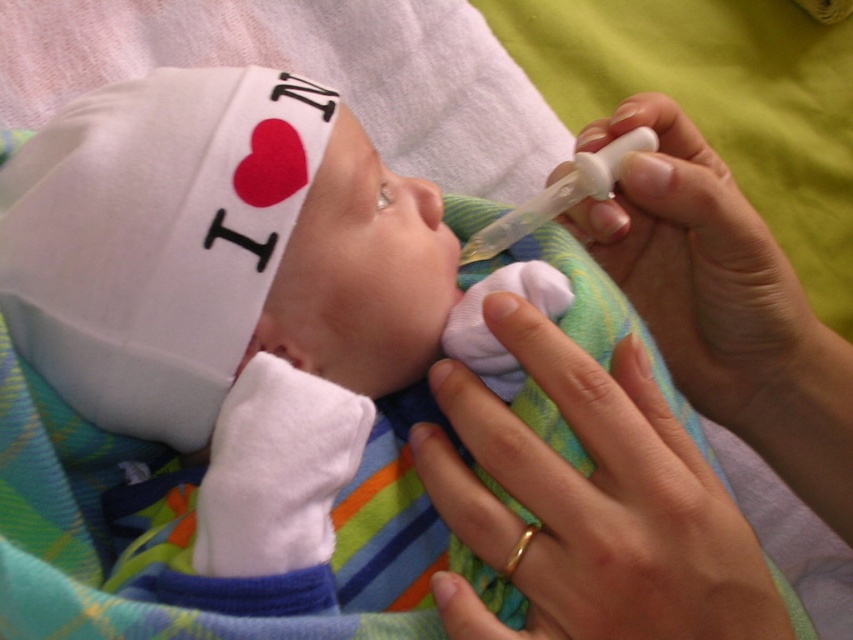
Who is more distant from viewer, (749, 344) or (431, 211)?

The point (749, 344) is behind.

Is white matte syringe at upper right to the right of smooth skin nose at center from the viewer's perspective?

Yes, white matte syringe at upper right is to the right of smooth skin nose at center.

Which is in front, point (718, 218) or point (410, 209)?

Positioned in front is point (410, 209).

Where is `white matte syringe at upper right`? The image size is (853, 640). white matte syringe at upper right is located at coordinates (708, 280).

Who is shorter, smooth skin nose at center or gold metallic teething ring at lower center?

With less height is gold metallic teething ring at lower center.

Does smooth skin nose at center lie in front of gold metallic teething ring at lower center?

That is False.

Locate an element on the screen. This screenshot has height=640, width=853. smooth skin nose at center is located at coordinates (422, 200).

Find the location of a particular element. This screenshot has width=853, height=640. smooth skin nose at center is located at coordinates (422, 200).

The width and height of the screenshot is (853, 640). What do you see at coordinates (236, 292) in the screenshot? I see `white soft fabric baby at center` at bounding box center [236, 292].

Between white soft fabric baby at center and gold metallic teething ring at lower center, which one is positioned lower?

Positioned lower is gold metallic teething ring at lower center.

Who is more distant from viewer, (155, 404) or (524, 548)?

The point (155, 404) is behind.

Identify the location of white soft fabric baby at center. The image size is (853, 640). tap(236, 292).